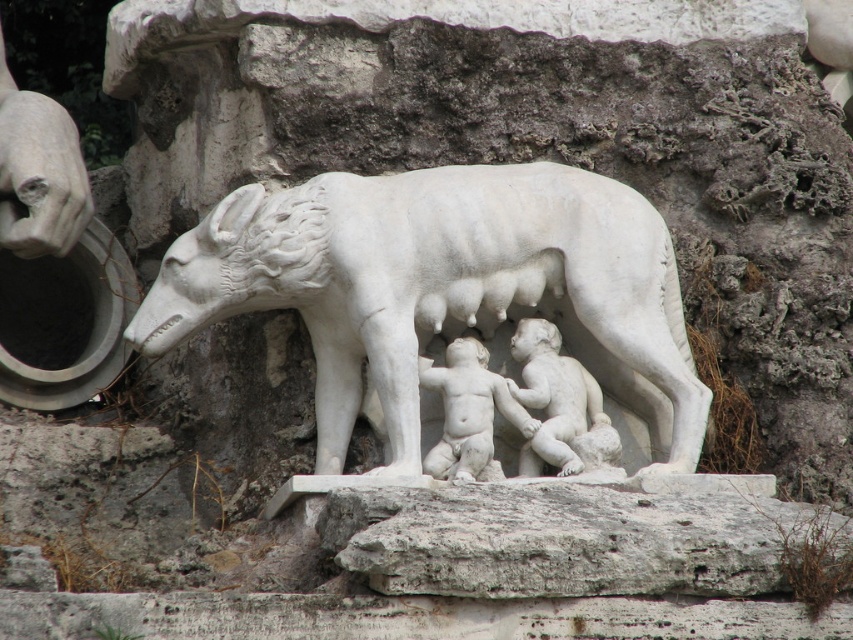
Question: Does white marble wolf at center lie behind smooth white cherub at center?

Choices:
 (A) yes
 (B) no

Answer: (B)

Question: Which object is farther from the camera taking this photo?

Choices:
 (A) white marble babies at center
 (B) white marble wolf at center

Answer: (A)

Question: Which point is closer to the camera?

Choices:
 (A) (538, 333)
 (B) (457, 392)

Answer: (B)

Question: Which object appears farthest from the camera in this image?

Choices:
 (A) smooth white cherub at center
 (B) white marble babies at center

Answer: (B)

Question: Does white marble babies at center have a larger size compared to smooth white cherub at center?

Choices:
 (A) yes
 (B) no

Answer: (B)

Question: Can you confirm if white marble wolf at center is wider than white marble babies at center?

Choices:
 (A) no
 (B) yes

Answer: (B)